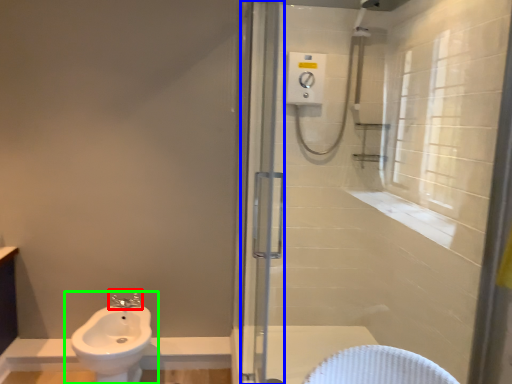
Question: Based on their relative distances, which object is farther from tap (highlighted by a red box)? Choose from screen door (highlighted by a blue box) and sink (highlighted by a green box).

Choices:
 (A) screen door
 (B) sink

Answer: (A)